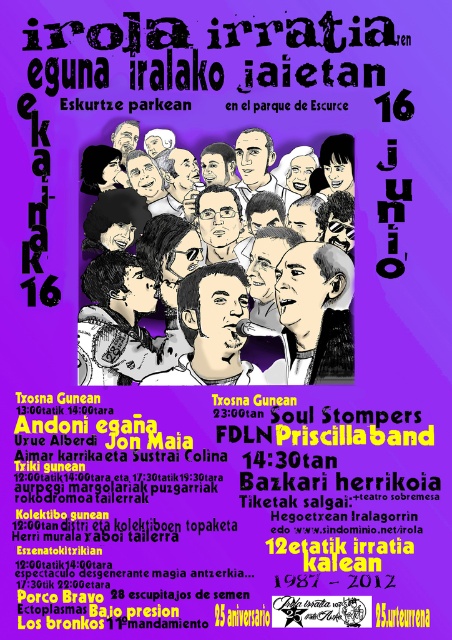
Does black ink drawing of man at center have a lesser height compared to matte black microphone at center?

No.

Between black ink drawing of man at center and matte black microphone at center, which one appears on the left side from the viewer's perspective?

black ink drawing of man at center

Where is `black ink drawing of man at center`? Image resolution: width=452 pixels, height=640 pixels. black ink drawing of man at center is located at coordinates (338, 349).

What are the coordinates of `black ink drawing of man at center` in the screenshot? It's located at (338, 349).

In the scene shown: Can you confirm if gray hair pencil sketch of man at center is shorter than black ink drawing of man at center?

Correct, gray hair pencil sketch of man at center is not as tall as black ink drawing of man at center.

Does point (325, 333) come farther from viewer compared to point (213, 148)?

That is True.

At what (x,y) coordinates should I click in order to perform the action: click on gray hair pencil sketch of man at center. Please return your answer as a coordinate pair (x, y). This screenshot has height=640, width=452. Looking at the image, I should click on (315, 310).

From the picture: Is gray hair pencil sketch of man at center behind matte black microphone at center?

No, it is in front of matte black microphone at center.

Find the location of `gray hair pencil sketch of man at center`. gray hair pencil sketch of man at center is located at coordinates (315, 310).